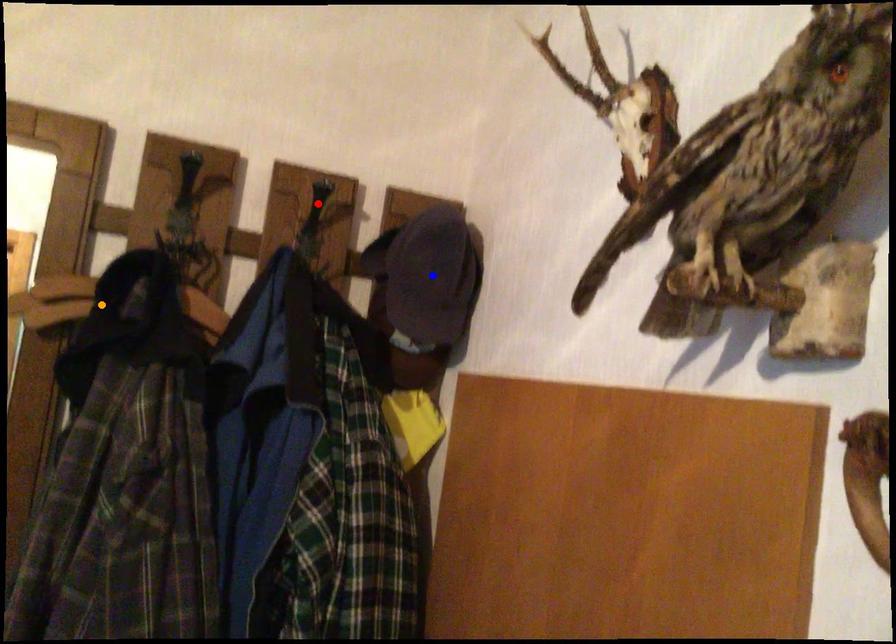
Order these from nearest to farthest:
red point | blue point | orange point

red point, blue point, orange point